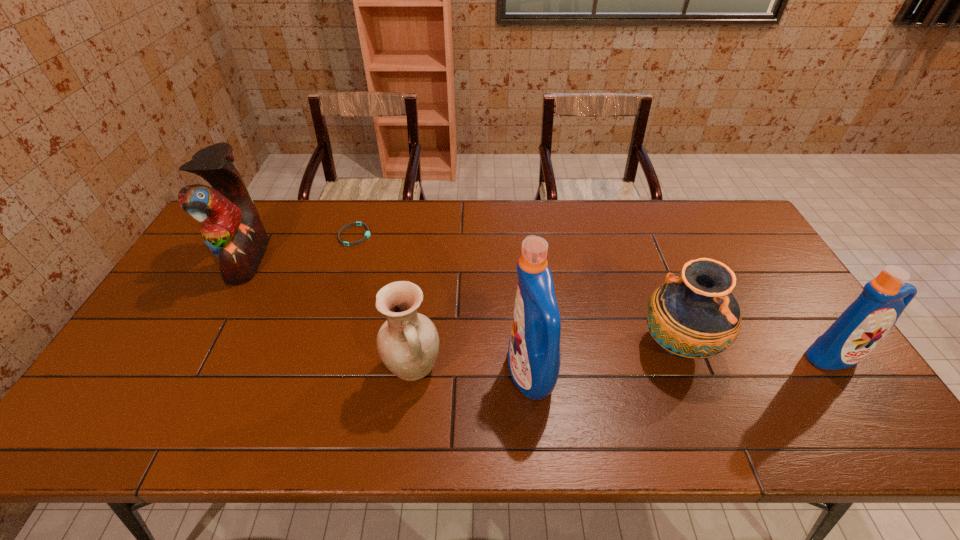
In order to click on free space that satisfies the following two spatial constraints: 1. on the buckle of the fifth object from right to left; 2. on the back side of the left pottery in this screenshot , I will do `click(314, 368)`.

Locate an element on the screen. This screenshot has width=960, height=540. free location that satisfies the following two spatial constraints: 1. on the back side of the fifth object from left to right; 2. at the face of the leftmost object is located at coordinates (644, 259).